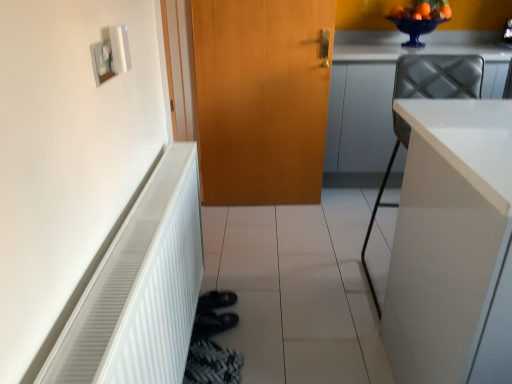
Question: From the image's perspective, is white ribbed radiator at left on top of white plastic light switch at upper left?

Choices:
 (A) no
 (B) yes

Answer: (A)

Question: Does white ribbed radiator at left have a greater height compared to white plastic light switch at upper left?

Choices:
 (A) yes
 (B) no

Answer: (A)

Question: Is white ribbed radiator at left smaller than white plastic light switch at upper left?

Choices:
 (A) no
 (B) yes

Answer: (A)

Question: Does white ribbed radiator at left have a lesser width compared to white plastic light switch at upper left?

Choices:
 (A) yes
 (B) no

Answer: (B)

Question: From the image's perspective, would you say white ribbed radiator at left is shown under white plastic light switch at upper left?

Choices:
 (A) no
 (B) yes

Answer: (B)

Question: From a real-world perspective, is white ribbed radiator at left physically above white plastic light switch at upper left?

Choices:
 (A) no
 (B) yes

Answer: (A)

Question: Can you confirm if white glossy cabinet at right, positioned as the 1th cabinetry in front-to-back order, is smaller than white ribbed radiator at left?

Choices:
 (A) yes
 (B) no

Answer: (B)

Question: From the image's perspective, is white glossy cabinet at right, acting as the second cabinetry starting from the back, on white ribbed radiator at left?

Choices:
 (A) no
 (B) yes

Answer: (B)

Question: From a real-world perspective, does white glossy cabinet at right, positioned as the 1th cabinetry in front-to-back order, stand above white ribbed radiator at left?

Choices:
 (A) yes
 (B) no

Answer: (A)

Question: From a real-world perspective, is white glossy cabinet at right, acting as the second cabinetry starting from the back, below white ribbed radiator at left?

Choices:
 (A) no
 (B) yes

Answer: (A)

Question: Does white glossy cabinet at right, acting as the second cabinetry starting from the back, have a lesser height compared to white ribbed radiator at left?

Choices:
 (A) yes
 (B) no

Answer: (B)

Question: Is white glossy cabinet at right, acting as the second cabinetry starting from the back, to the right of white ribbed radiator at left from the viewer's perspective?

Choices:
 (A) no
 (B) yes

Answer: (B)

Question: Is white plastic light switch at upper left shorter than white glossy cabinet at upper right, placed as the second cabinetry when sorted from front to back?

Choices:
 (A) yes
 (B) no

Answer: (A)